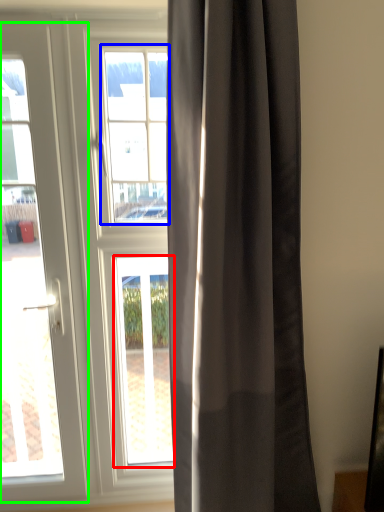
Question: Which object is positioned farthest from window (highlighted by a red box)? Select from bay window (highlighted by a blue box) and door (highlighted by a green box).

Choices:
 (A) bay window
 (B) door

Answer: (A)